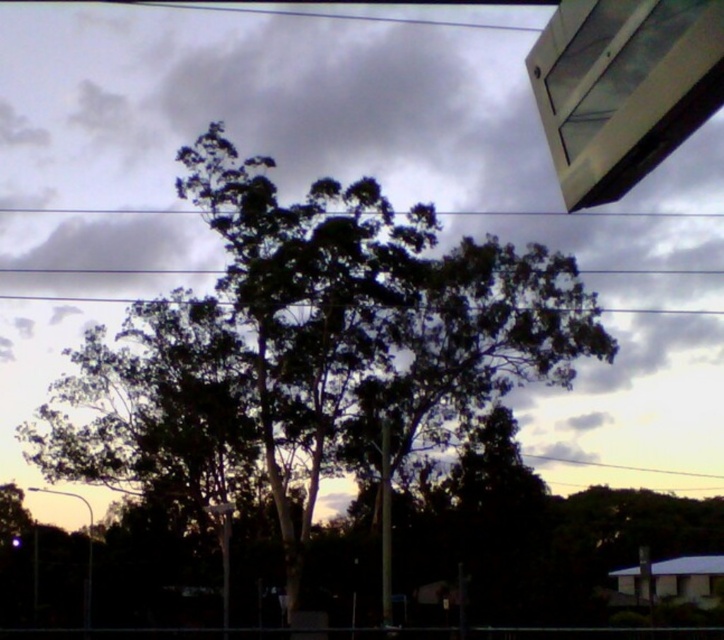
Question: Which point is closer to the camera taking this photo?

Choices:
 (A) (298, 412)
 (B) (75, 208)

Answer: (A)

Question: Which point is closer to the camera?

Choices:
 (A) white plastic street sign at lower center
 (B) black wire at upper center
 (C) dark gray cloud at upper center

Answer: (C)

Question: Does dark gray cloud at upper center have a larger size compared to green leafy tree at center?

Choices:
 (A) no
 (B) yes

Answer: (B)

Question: Can you confirm if dark gray cloud at upper center is thinner than green leafy tree at center?

Choices:
 (A) no
 (B) yes

Answer: (A)

Question: Does dark gray cloud at upper center appear over white plastic street sign at lower center?

Choices:
 (A) yes
 (B) no

Answer: (A)

Question: Which of the following is the farthest from the observer?

Choices:
 (A) dark gray cloud at upper center
 (B) green leafy tree at center
 (C) white plastic street sign at lower center

Answer: (B)